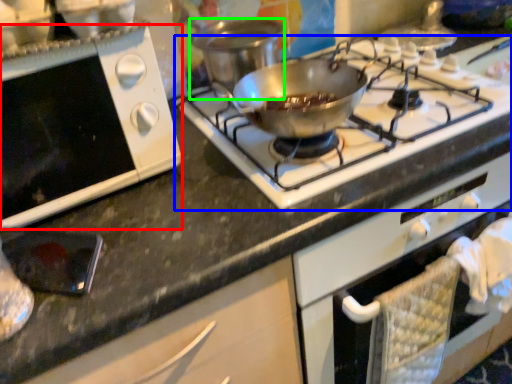
Question: Estimate the real-world distances between objects in this image. Which object is closer to oven (highlighted by a red box), gas stove (highlighted by a blue box) or pot/pan (highlighted by a green box)?

Choices:
 (A) gas stove
 (B) pot/pan

Answer: (B)